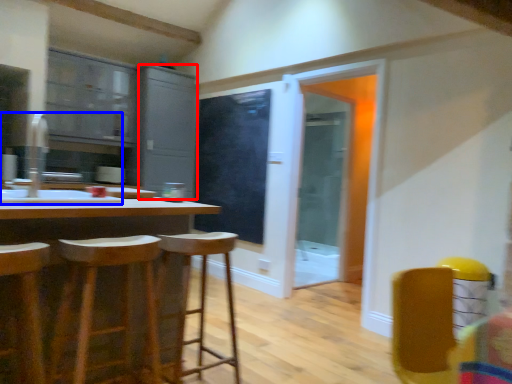
Question: Which of the following is the closest to the observer, cabinetry (highlighted by a red box) or sink (highlighted by a blue box)?

Choices:
 (A) cabinetry
 (B) sink

Answer: (B)